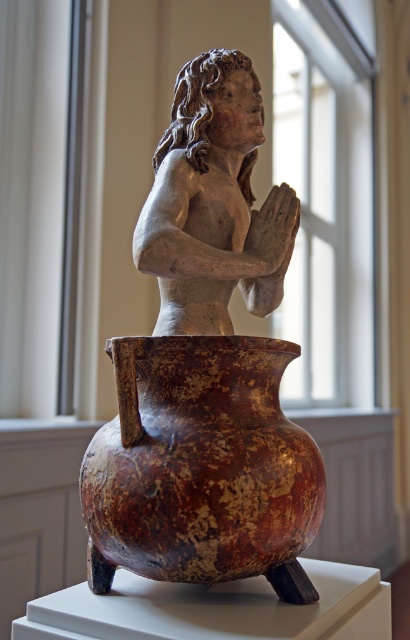
Question: Is the position of matte clay figure at center more distant than that of rusty ceramic vase at center?

Choices:
 (A) no
 (B) yes

Answer: (B)

Question: Estimate the real-world distances between objects in this image. Which object is farther from the matte gray statue at center?

Choices:
 (A) matte clay figure at center
 (B) rusty ceramic vase at center

Answer: (B)

Question: In this image, where is matte clay figure at center located relative to matte gray statue at center?

Choices:
 (A) right
 (B) left

Answer: (B)

Question: Is rusty ceramic vase at center above matte gray statue at center?

Choices:
 (A) no
 (B) yes

Answer: (A)

Question: Among these points, which one is nearest to the camera?

Choices:
 (A) (182, 552)
 (B) (268, 195)

Answer: (A)

Question: Which point is closer to the camera?

Choices:
 (A) rusty ceramic vase at center
 (B) matte clay figure at center
 (C) matte gray statue at center

Answer: (A)